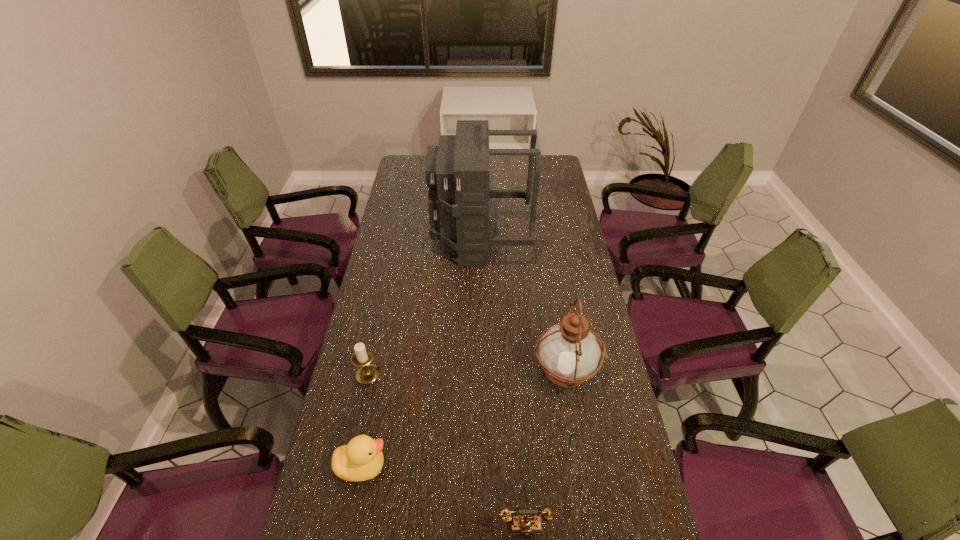
The height and width of the screenshot is (540, 960). I want to click on free space located at the beak of the second nearest object, so click(427, 467).

Find the location of `candle holder located in the left edge section of the desktop`. candle holder located in the left edge section of the desktop is located at coordinates (367, 373).

Identify the location of duck at the left edge. (362, 459).

This screenshot has width=960, height=540. What are the coordinates of `object present at the right edge` in the screenshot? It's located at (569, 353).

Where is `vacant space at the left edge of the desktop`? vacant space at the left edge of the desktop is located at coordinates (396, 230).

In the image, there is a desktop. What are the coordinates of `free space at the right edge` in the screenshot? It's located at (549, 231).

Where is `vacant space at the far left corner of the desktop`? vacant space at the far left corner of the desktop is located at coordinates (408, 170).

In order to click on free space between the candle holder and the duck in this screenshot , I will do `click(365, 420)`.

Where is `vacant area that lies between the duck and the oil lamp`? This screenshot has height=540, width=960. vacant area that lies between the duck and the oil lamp is located at coordinates (464, 419).

You are a GUI agent. You are given a task and a screenshot of the screen. Output one action in this format:
    pyautogui.click(x=<x>, y=<y>)
    Task: Click on the free area in between the backpack and the fourth farthest object
    
    Given the screenshot: What is the action you would take?
    pyautogui.click(x=421, y=353)